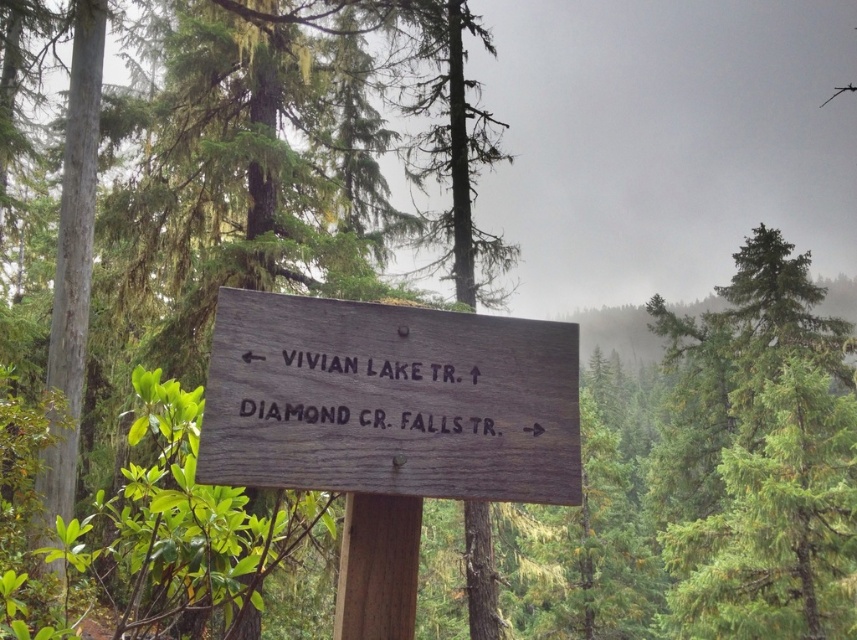
Where is the green wood sign at center located in the image?

The green wood sign at center is located at point (255, 157).

What are the coordinates of the green wood sign at center?

The green wood sign at center is located at coordinates point (255, 157).

Looking at this image, you are standing in front of the signpost in the forest. Which object, the weathered wood sign at center or the brown wooden post at center, is positioned to the right of the other?

The weathered wood sign at center is to the right of the brown wooden post at center.